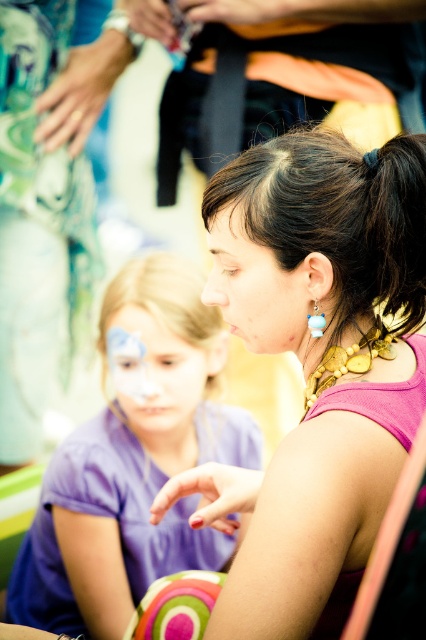
Question: Which object is the farthest from the pink fabric at center?

Choices:
 (A) matte pink face at center
 (B) matte purple face at center
 (C) blue plastic earring at center
 (D) purple fabric shirt at center

Answer: (D)

Question: Is the position of matte purple face at center less distant than that of blue plastic earring at center?

Choices:
 (A) yes
 (B) no

Answer: (B)

Question: From the image, what is the correct spatial relationship of pink fabric at center in relation to matte purple face at center?

Choices:
 (A) left
 (B) right

Answer: (B)

Question: Is pink fabric at center to the left of matte pink face at center from the viewer's perspective?

Choices:
 (A) no
 (B) yes

Answer: (A)

Question: Which of the following is the closest to the observer?

Choices:
 (A) matte pink face at center
 (B) purple fabric shirt at center
 (C) matte purple face at center
 (D) pink fabric at center

Answer: (D)

Question: Which of the following is the farthest from the observer?

Choices:
 (A) matte purple face at center
 (B) pink fabric at center
 (C) blue plastic earring at center
 (D) purple fabric shirt at center

Answer: (A)